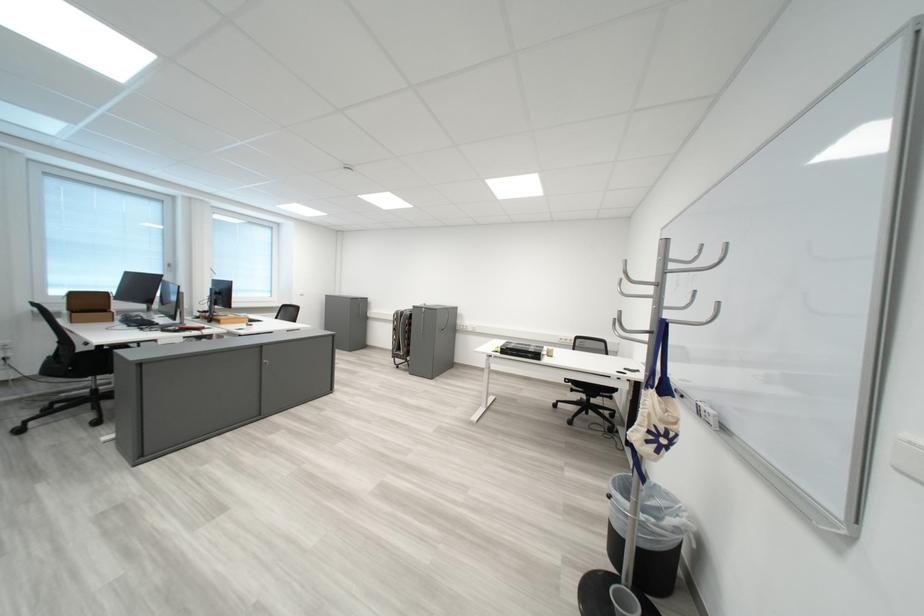
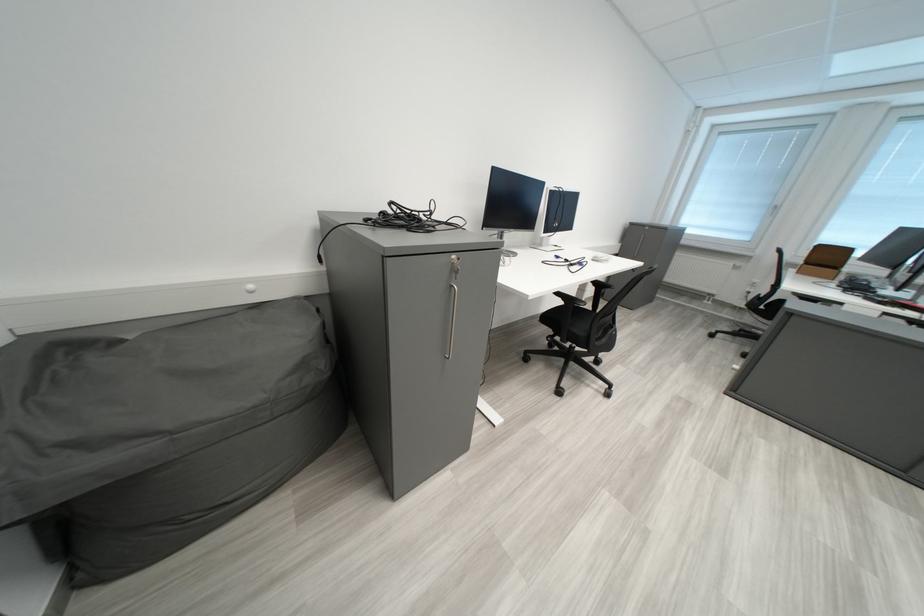
In the second image, find the point that corresponds to pixel 89 296 in the first image.

(833, 249)